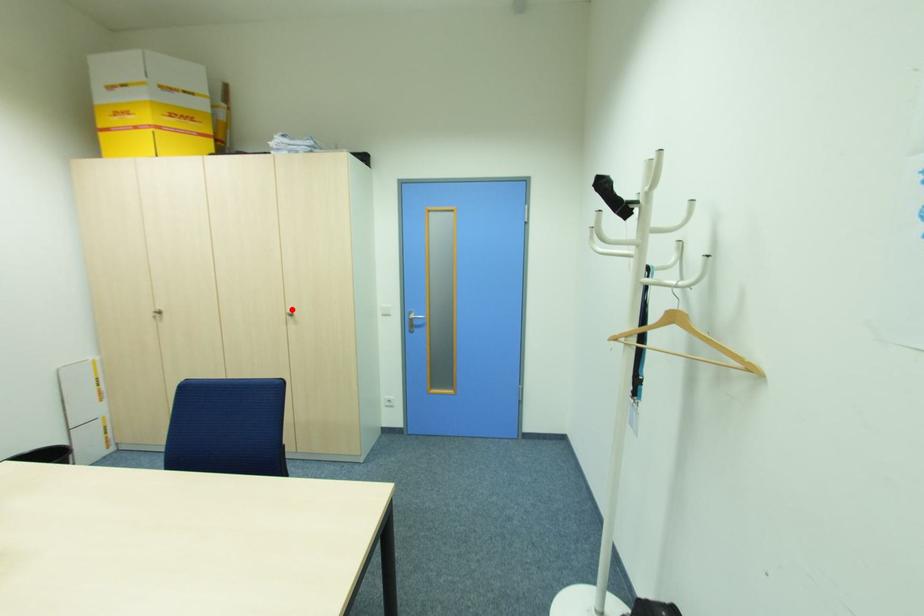
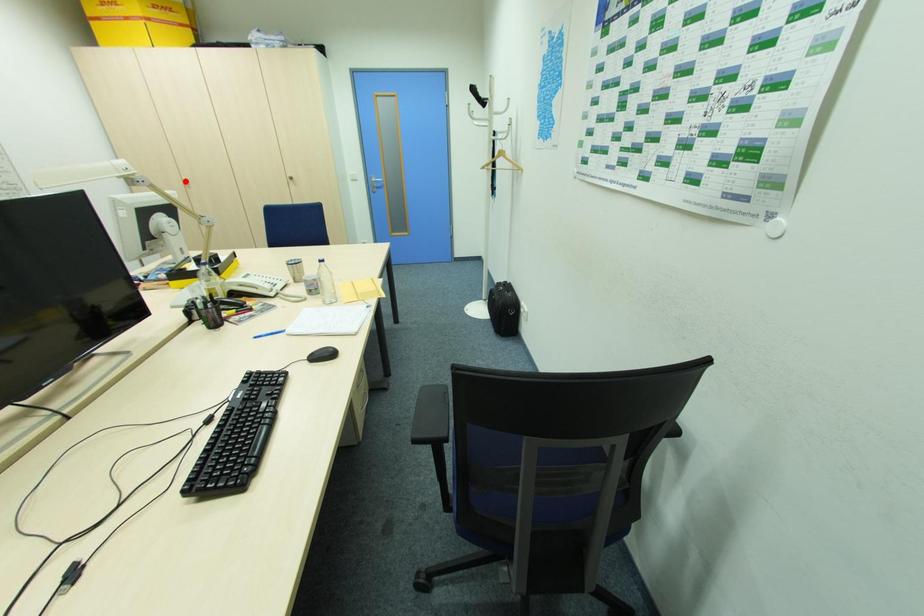
I am providing you with two images of the same scene from different viewpoints. A red point is marked on the first image and another point is marked on the second image. Does the point marked in image1 correspond to the same location as the one in image2?

No